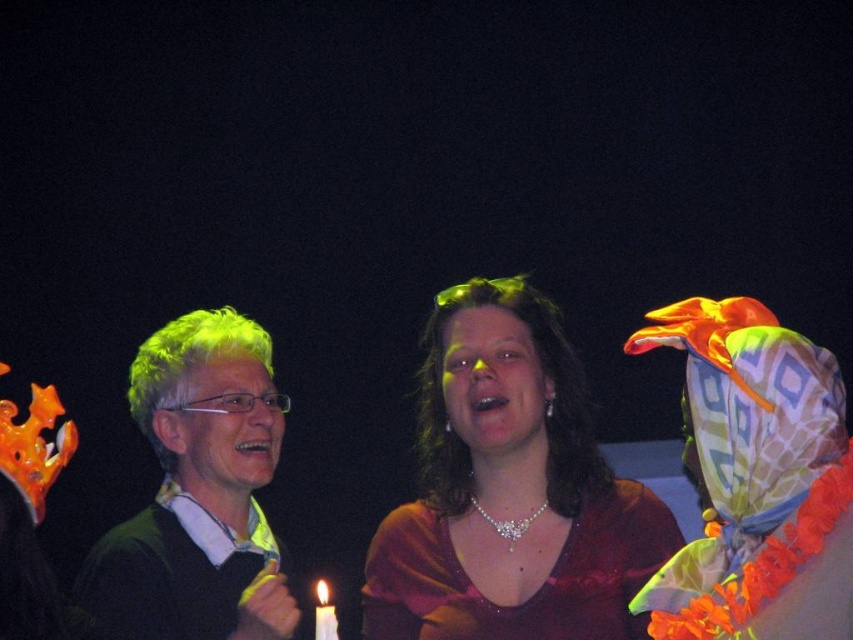
You are a photographer taking a portrait of the two people in the scene. You need to ensure that the green matte sweater at left and the smooth skin face at center are both clearly visible in the frame. Based on their sizes, which object should you focus on to ensure both are in focus?

The green matte sweater at left is wider than the smooth skin face at center, so focusing on the green matte sweater at left will help ensure both are in focus as it covers a larger area.

You are a photographer at a party and want to capture a photo of the two people in the foreground. The camera you are using has a limited depth of field that can only focus on one object at a time. Which object between the satin burgundy dress at center and the smooth skin face at center should you focus on to ensure it appears sharp in the photo?

The satin burgundy dress at center has a greater height compared to the smooth skin face at center, so focusing on the satin burgundy dress at center would ensure it appears sharp in the photo.